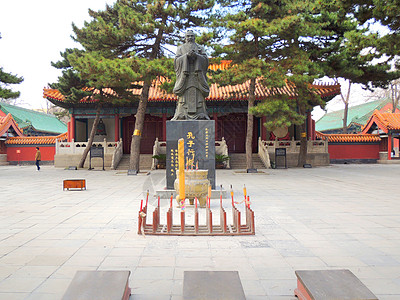
In order to click on red wall in this screenshot , I will do `click(351, 152)`.